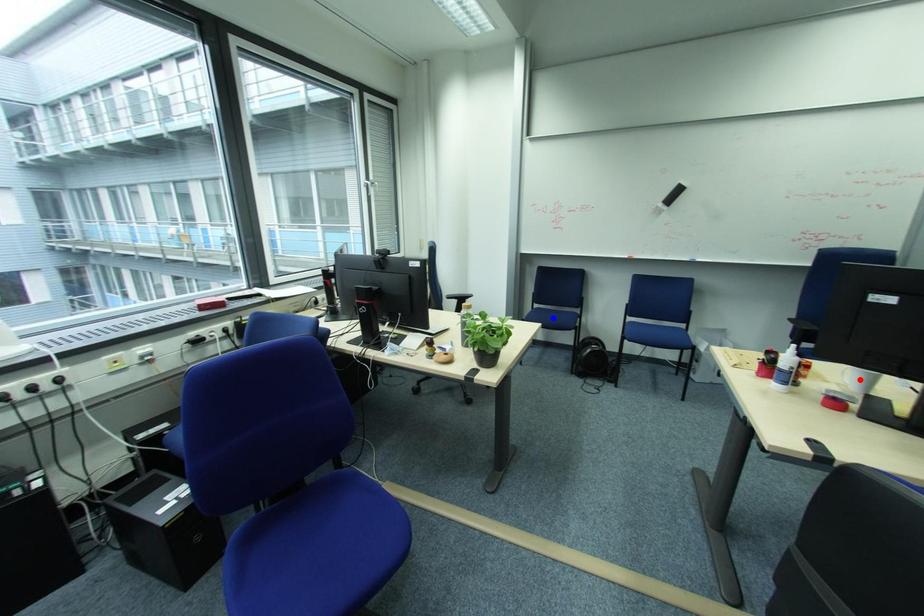
Question: In the image, two points are highlighted. Which point is nearer to the camera? Reply with the corresponding letter.

Choices:
 (A) blue point
 (B) red point

Answer: (B)